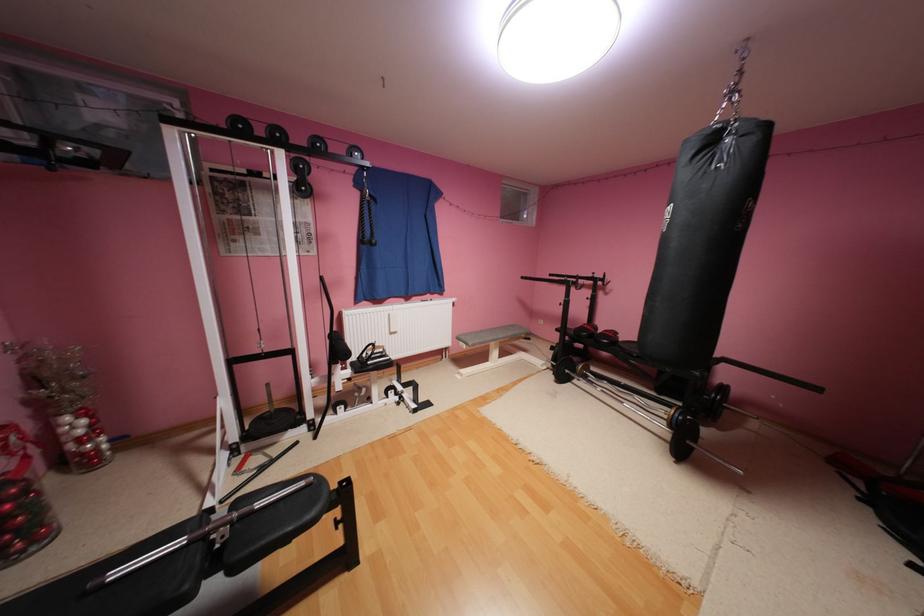
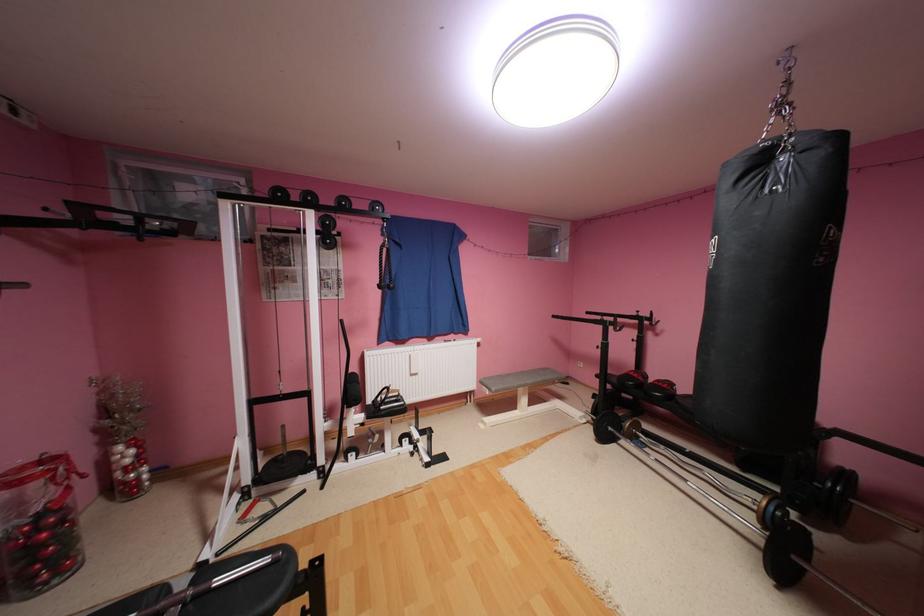
Locate, in the second image, the point that corresponds to [508,336] in the first image.

(538, 382)